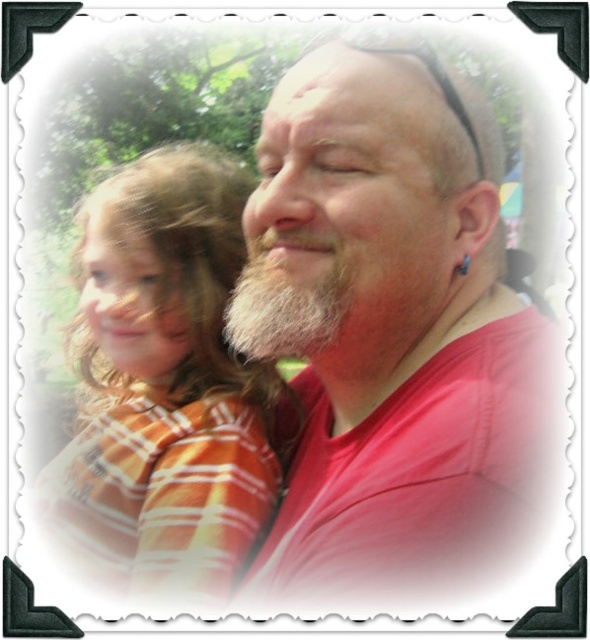
Question: Considering the relative positions of orange striped shirt at left and whitewoollybeard at center in the image provided, where is orange striped shirt at left located with respect to whitewoollybeard at center?

Choices:
 (A) above
 (B) below

Answer: (B)

Question: Which point is closer to the camera?

Choices:
 (A) white beard at center
 (B) orange striped shirt at left

Answer: (A)

Question: Which point appears closest to the camera in this image?

Choices:
 (A) (132, 573)
 (B) (513, 339)

Answer: (B)

Question: Which object is farther from the camera taking this photo?

Choices:
 (A) orange striped shirt at left
 (B) whitewoollybeard at center
 (C) white beard at center

Answer: (A)

Question: Does orange striped shirt at left have a lesser width compared to whitewoollybeard at center?

Choices:
 (A) yes
 (B) no

Answer: (B)

Question: Can you confirm if white beard at center is thinner than orange striped shirt at left?

Choices:
 (A) yes
 (B) no

Answer: (A)